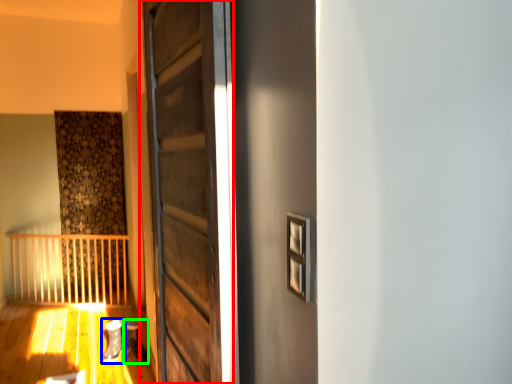
Question: Which is nearer to the door (highlighted by a red box)? shoe (highlighted by a blue box) or shoe (highlighted by a green box).

Choices:
 (A) shoe
 (B) shoe

Answer: (A)